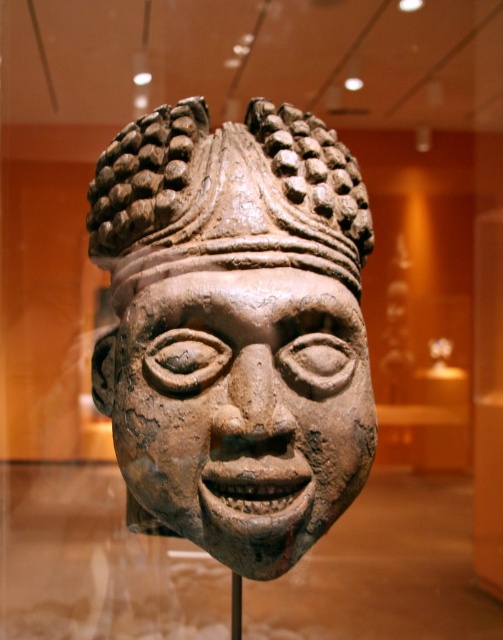
Question: Which object appears closest to the camera in this image?

Choices:
 (A) brown clay mask at center
 (B) earthy clay headdress at center

Answer: (A)

Question: Is brown clay mask at center smaller than earthy clay headdress at center?

Choices:
 (A) no
 (B) yes

Answer: (A)

Question: Observing the image, what is the correct spatial positioning of brown clay mask at center in reference to earthy clay headdress at center?

Choices:
 (A) below
 (B) above

Answer: (A)

Question: Which of the following is the closest to the observer?

Choices:
 (A) (209, 244)
 (B) (356, 470)

Answer: (A)

Question: Which point is closer to the camera?

Choices:
 (A) (345, 301)
 (B) (139, 161)

Answer: (A)

Question: Can you confirm if brown clay mask at center is thinner than earthy clay headdress at center?

Choices:
 (A) no
 (B) yes

Answer: (B)